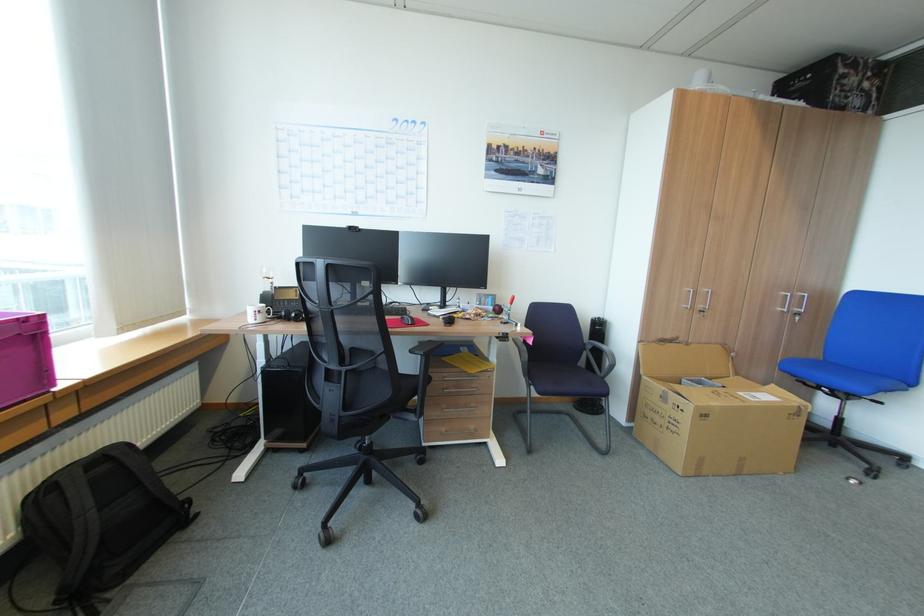
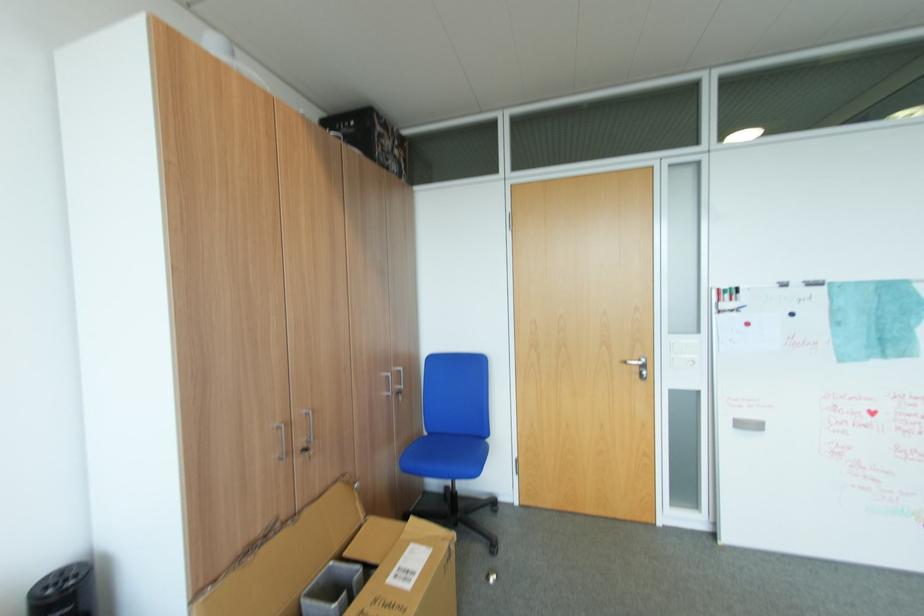
Find the pixel in the second image that matches point (708, 310) in the first image.

(310, 451)